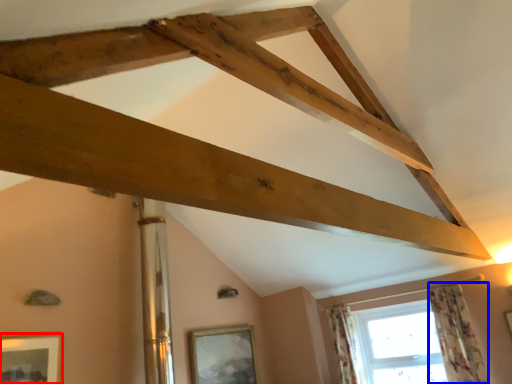
Question: Among these objects, which one is farthest to the camera, picture frame (highlighted by a red box) or curtain (highlighted by a blue box)?

Choices:
 (A) picture frame
 (B) curtain

Answer: (B)